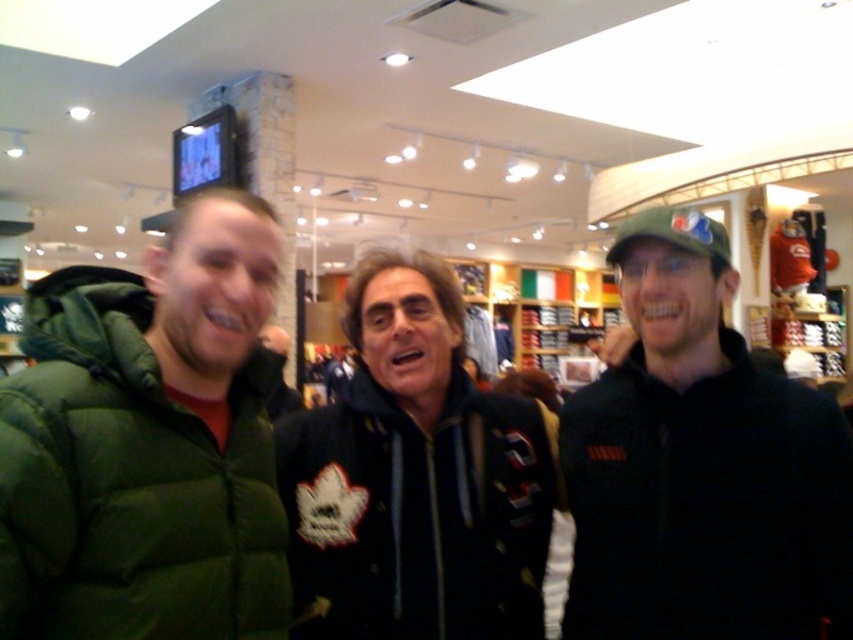
Question: Which point is closer to the camera taking this photo?

Choices:
 (A) (428, 634)
 (B) (70, 465)

Answer: (B)

Question: Which point is closer to the camera?

Choices:
 (A) black fleece jacket at center
 (B) black matte jacket at right

Answer: (B)

Question: Does black matte jacket at right appear on the left side of green puffy jacket at left?

Choices:
 (A) yes
 (B) no

Answer: (B)

Question: Is black matte jacket at right to the left of black fleece jacket at center from the viewer's perspective?

Choices:
 (A) no
 (B) yes

Answer: (A)

Question: Which point appears closest to the camera in this image?

Choices:
 (A) (189, 449)
 (B) (824, 595)
 (C) (514, 433)

Answer: (A)

Question: Is green puffy jacket at left closer to the viewer compared to black fleece jacket at center?

Choices:
 (A) yes
 (B) no

Answer: (A)